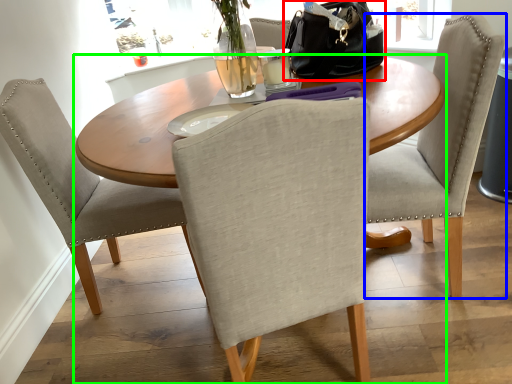
Question: Considering the real-world distances, which object is closest to handbag (highlighted by a red box)? chair (highlighted by a blue box) or kitchen & dining room table (highlighted by a green box).

Choices:
 (A) chair
 (B) kitchen & dining room table

Answer: (A)